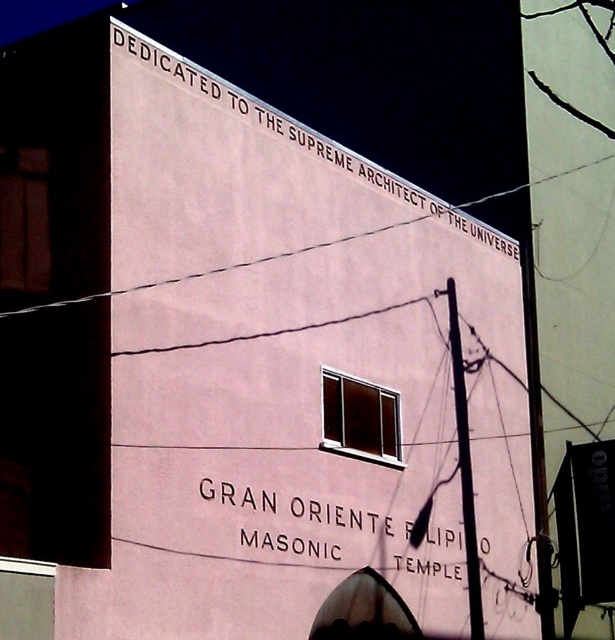
What are the coordinates of the black text at upper center?

The coordinates of the black text at upper center are at point (x=292, y=132).

Which text is wider between the black text at upper center and the white painted text at center?

The black text at upper center is wider than the white painted text at center according to the description.

You are standing at the entrance of the building and want to read the black text at upper center on the signboard. Considering your eyesight, which can clearly see objects up to 150 feet away, will you be able to read it without moving closer?

The black text at upper center is 160.63 feet away from the viewer, which is beyond your eyesight limit of 150 feet. Therefore, you will not be able to read it clearly without moving closer.